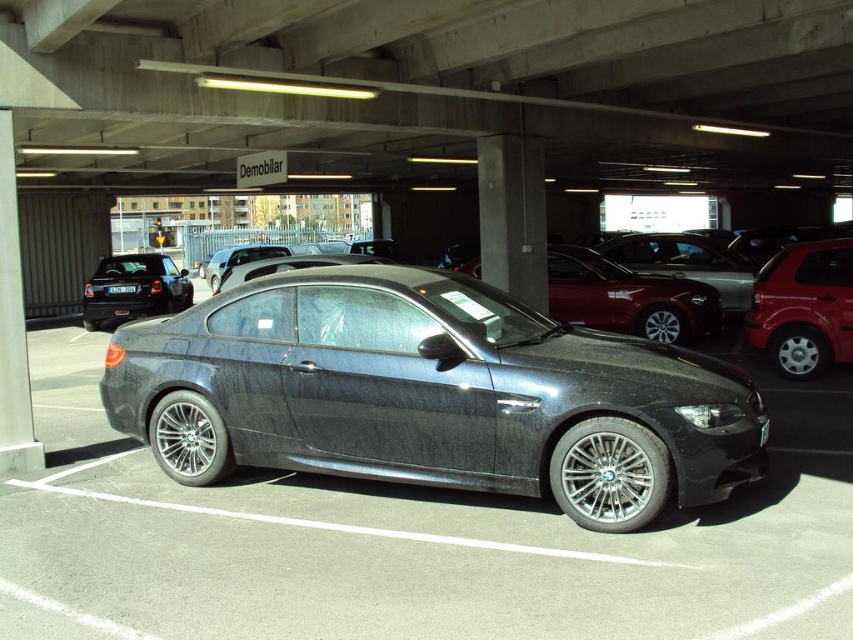
You are a delivery person trying to park your van between the metallic red hatchback at right and the matte black sedan at left. Can you fit your van, which is 2 meters wide, in the space between them?

The metallic red hatchback at right is positioned on the right side of matte black sedan at left. Since the hatchback is to the right of the sedan, there is space between them. However, the exact width isn not provided, so it is uncertain if the 2 meter van will fit.

You are a parking attendant who needs to ensure all vehicles fit within their parking spaces. Given that the parking space is designed to accommodate the width of the black plastic license plate at center, will the metallic gray car at center fit properly?

The metallic gray car at center is wider than the black plastic license plate at center, so it may not fit properly within the parking space designed for the license plate width.